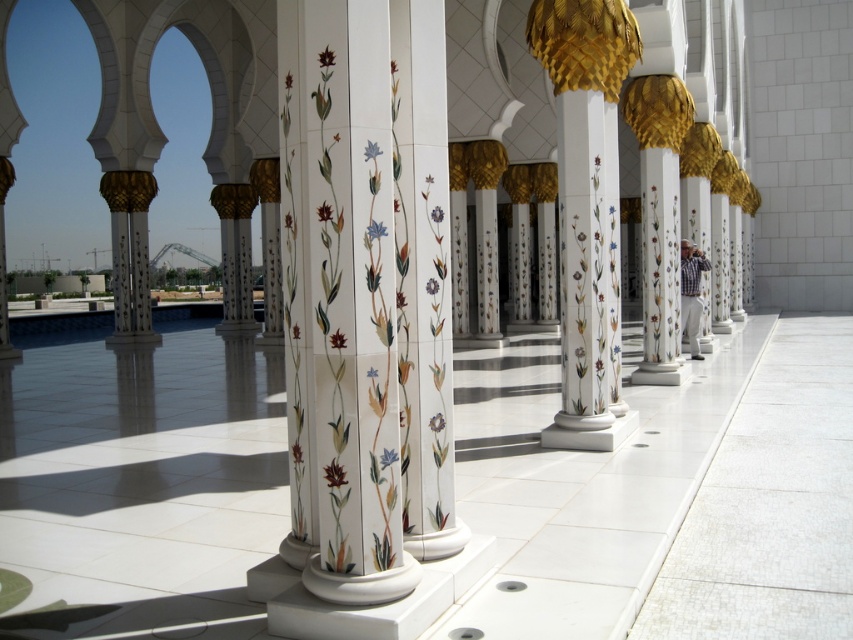
You are an architect designing a new garden and want to place a small statue between the porcelain floral columns at center and the white marble column at center. Since you want the statue to be visible from both columns, which column should the statue be closer to? Please explain your reasoning based on their heights.

The porcelain floral columns at center is not as tall as the white marble column at center, so the statue should be placed closer to the taller white marble column at center to ensure visibility from both columns.

You are an architect reviewing the design of the outdoor area. You notice two columns at the center of the layout. Which one is located to the left of the other? The options are the porcelain floral columns at center and the white marble column at center.

The porcelain floral columns at center is positioned on the left side of white marble column at center.